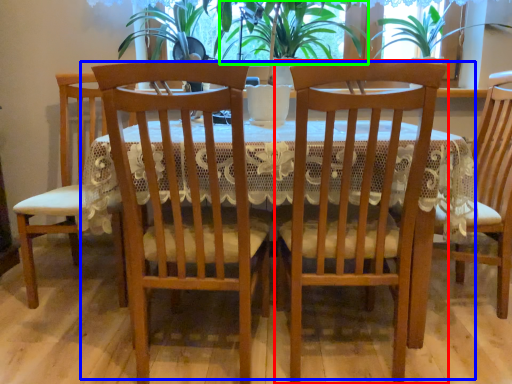
Question: Which is farther away from chair (highlighted by a red box)? kitchen & dining room table (highlighted by a blue box) or plant (highlighted by a green box)?

Choices:
 (A) kitchen & dining room table
 (B) plant

Answer: (B)